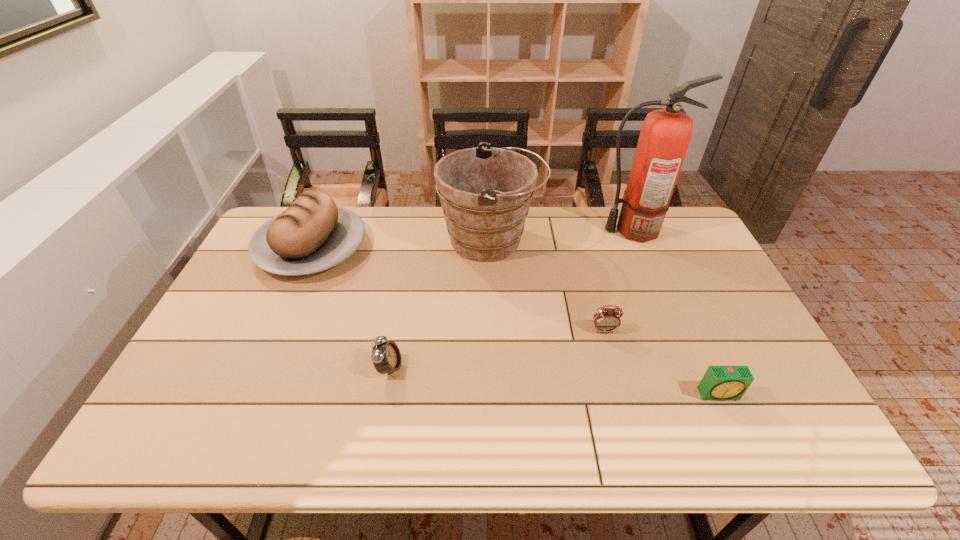
The height and width of the screenshot is (540, 960). I want to click on fire extinguisher, so click(x=665, y=135).

Locate an element on the screen. The height and width of the screenshot is (540, 960). the third object from left to right is located at coordinates (485, 192).

Where is `the second tallest object`? The image size is (960, 540). the second tallest object is located at coordinates (485, 192).

I want to click on bread, so click(313, 234).

Where is `the fourth shortest object`? the fourth shortest object is located at coordinates (313, 234).

Where is `the second farthest alarm clock`? the second farthest alarm clock is located at coordinates (386, 356).

Find the location of a particular element. the fifth object from right to left is located at coordinates 386,356.

Locate an element on the screen. The height and width of the screenshot is (540, 960). the second alarm clock from right to left is located at coordinates (605, 320).

The image size is (960, 540). Find the location of `the fourth farthest object`. the fourth farthest object is located at coordinates (605, 320).

Locate an element on the screen. This screenshot has width=960, height=540. the nearest alarm clock is located at coordinates (720, 383).